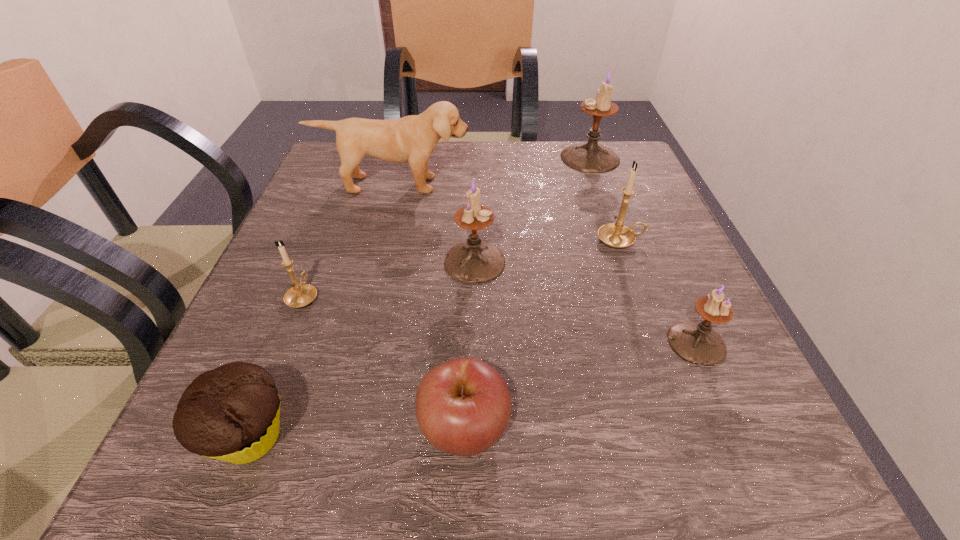
Where is `free space located 0.140m on the handle side of the leftmost candle holder`? free space located 0.140m on the handle side of the leftmost candle holder is located at coordinates (328, 232).

Identify the location of vacant space positioned 0.070m on the left of the smallest purple candle holder. The image size is (960, 540). (623, 342).

Identify the location of free space located 0.250m on the right of the muffin. Image resolution: width=960 pixels, height=540 pixels. (492, 437).

The width and height of the screenshot is (960, 540). In order to click on vacant region located 0.310m on the side of the apple with the unique marking in this screenshot , I will do `click(749, 428)`.

This screenshot has width=960, height=540. In order to click on candle holder located at the far edge in this screenshot , I will do `click(590, 157)`.

The height and width of the screenshot is (540, 960). I want to click on puppy that is at the far edge, so click(413, 138).

This screenshot has height=540, width=960. In order to click on muffin at the near edge in this screenshot , I will do `click(232, 413)`.

Where is `apple located in the near edge section of the desktop`? The height and width of the screenshot is (540, 960). apple located in the near edge section of the desktop is located at coordinates (463, 406).

At what (x,y) coordinates should I click in order to perform the action: click on puppy at the left edge. Please return your answer as a coordinate pair (x, y). Looking at the image, I should click on point(413,138).

This screenshot has width=960, height=540. In order to click on candle holder at the left edge in this screenshot , I will do `click(299, 295)`.